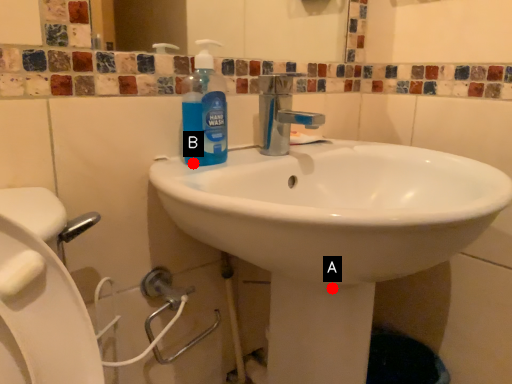
Question: Two points are circled on the image, labeled by A and B beside each circle. Which point is farther to the camera?

Choices:
 (A) A is further
 (B) B is further

Answer: (B)